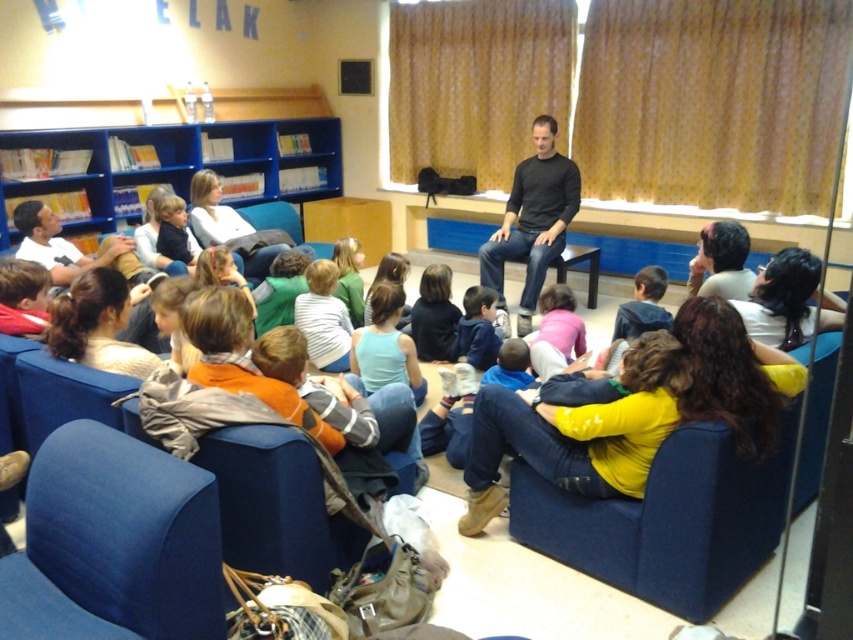
Is dark blue shirt at center bigger than smooth brown hair at center?

No.

Does point (421, 289) come farther from viewer compared to point (399, 321)?

No, (421, 289) is in front of (399, 321).

Locate an element on the screen. dark blue shirt at center is located at coordinates (434, 316).

Is light blue fabric shirt at center thinner than smooth brown hair at center?

In fact, light blue fabric shirt at center might be wider than smooth brown hair at center.

Does light blue fabric shirt at center appear on the left side of smooth brown hair at center?

Yes, light blue fabric shirt at center is to the left of smooth brown hair at center.

In the scene shown: Measure the distance between light blue fabric shirt at center and camera.

11.03 feet

This screenshot has width=853, height=640. Find the location of `light blue fabric shirt at center`. light blue fabric shirt at center is located at coordinates (386, 346).

Looking at this image, between blue fabric armchair at lower left and blue plastic bookshelf at upper left, which one is positioned higher?

Positioned higher is blue plastic bookshelf at upper left.

Which of these two, blue fabric armchair at lower left or blue plastic bookshelf at upper left, stands shorter?

With less height is blue fabric armchair at lower left.

Does point (140, 632) lie in front of point (302, 129)?

Yes, point (140, 632) is closer to viewer.

Find the location of a particular element. The height and width of the screenshot is (640, 853). blue fabric armchair at lower left is located at coordinates (114, 544).